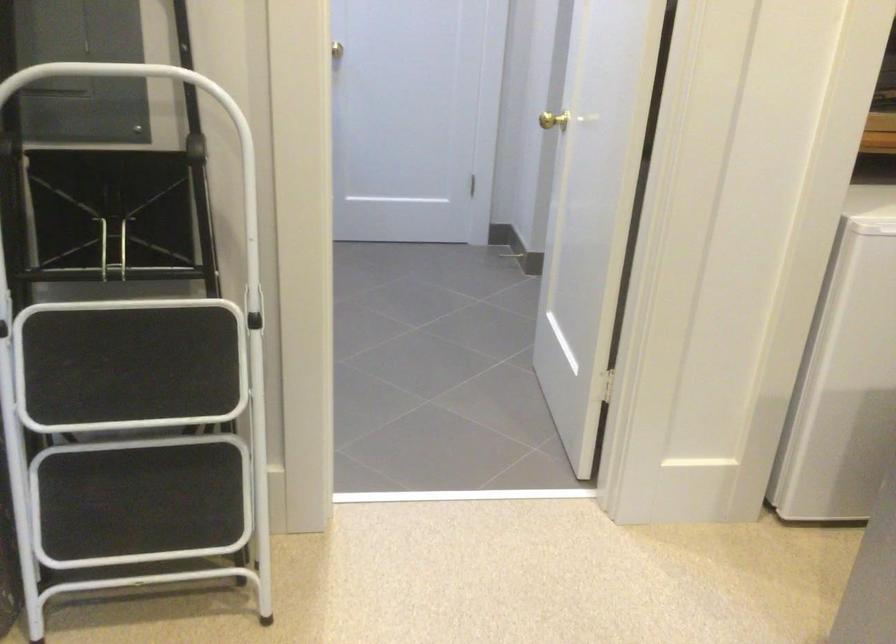
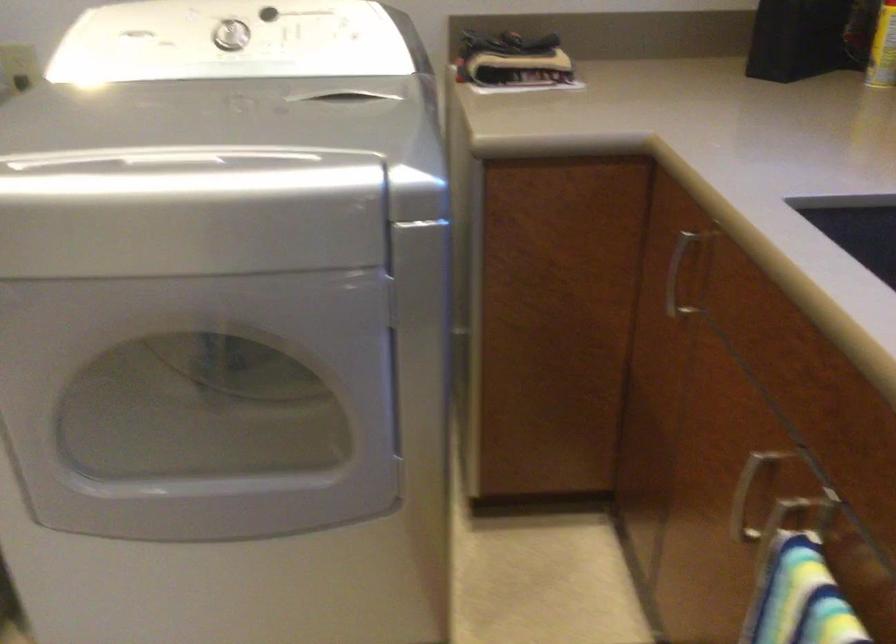
Based on the photo, the first image is from the beginning of the video and the second image is from the end. How did the camera likely rotate when shooting the video?

The camera's rotation is toward right-down.